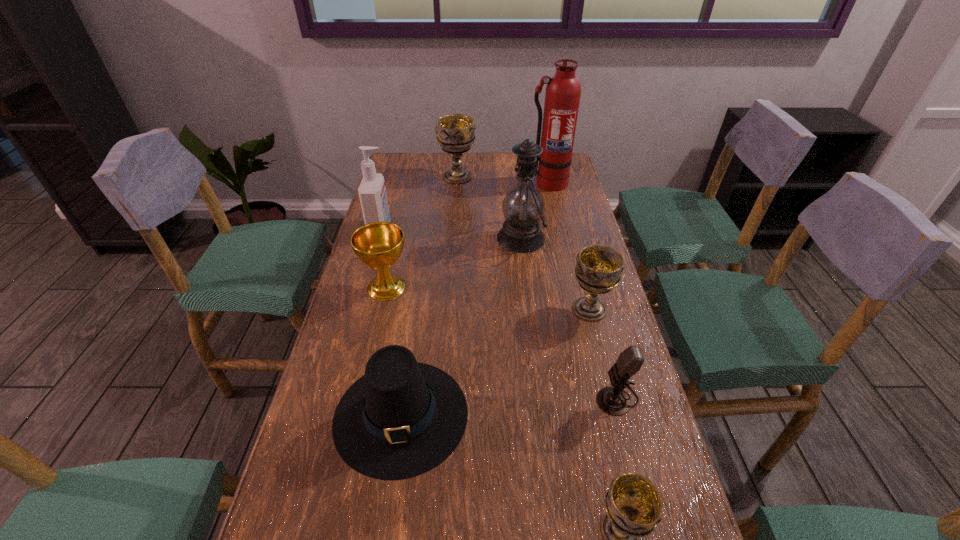
Identify the location of chalice that is at the far edge. The width and height of the screenshot is (960, 540). (455, 133).

Identify the location of cleansing agent at the left edge. The width and height of the screenshot is (960, 540). (372, 192).

This screenshot has width=960, height=540. I want to click on chalice that is at the left edge, so click(x=378, y=245).

At what (x,y) coordinates should I click in order to perform the action: click on hat that is at the left edge. Please return your answer as a coordinate pair (x, y). Image resolution: width=960 pixels, height=540 pixels. Looking at the image, I should click on (403, 418).

Where is `fire extinguisher positioned at the right edge`? This screenshot has width=960, height=540. fire extinguisher positioned at the right edge is located at coordinates (563, 91).

The height and width of the screenshot is (540, 960). Find the location of `oil lamp that is at the right edge`. oil lamp that is at the right edge is located at coordinates (523, 207).

At what (x,y) coordinates should I click in order to perform the action: click on chalice that is at the right edge. Please return your answer as a coordinate pair (x, y). Image resolution: width=960 pixels, height=540 pixels. Looking at the image, I should click on (599, 268).

Image resolution: width=960 pixels, height=540 pixels. I want to click on microphone located at the right edge, so click(x=613, y=400).

Identify the location of object located at the far right corner. (563, 91).

In the image, there is a desktop. Identify the location of vacant space at the left edge. (391, 301).